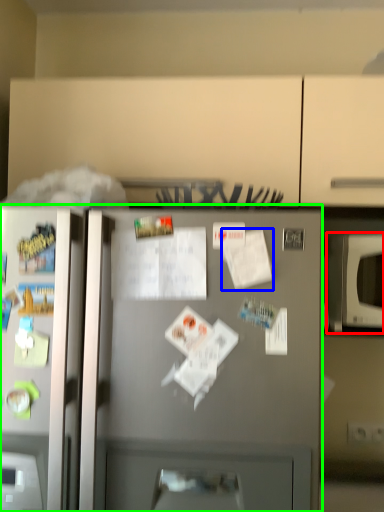
Question: Considering the real-world distances, which object is closest to microwave oven (highlighted by a red box)? paper (highlighted by a blue box) or refrigerator (highlighted by a green box).

Choices:
 (A) paper
 (B) refrigerator

Answer: (A)